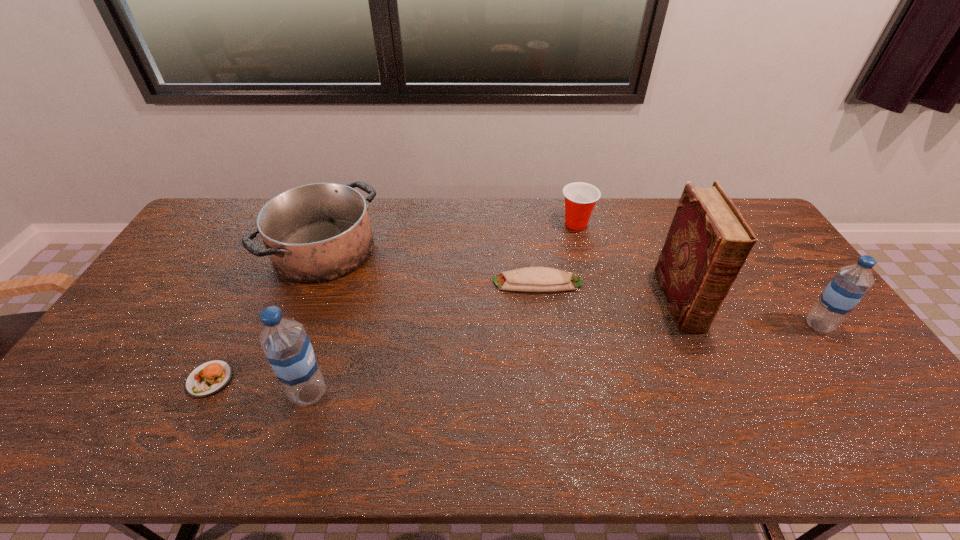
This screenshot has width=960, height=540. In order to click on the nearer water bottle in this screenshot , I will do `click(288, 348)`.

At what (x,y) coordinates should I click in order to perform the action: click on the taller water bottle. Please return your answer as a coordinate pair (x, y). This screenshot has height=540, width=960. Looking at the image, I should click on (288, 348).

Image resolution: width=960 pixels, height=540 pixels. What are the coordinates of `the right water bottle` in the screenshot? It's located at (850, 284).

You are a GUI agent. You are given a task and a screenshot of the screen. Output one action in this format:
    pyautogui.click(x=<x>, y=<y>)
    Task: Click on the shorter water bottle
    
    Given the screenshot: What is the action you would take?
    pyautogui.click(x=850, y=284)

You are a GUI agent. You are given a task and a screenshot of the screen. Output one action in this format:
    pyautogui.click(x=<x>, y=<y>)
    Task: Click on the fourth tallest object
    Image resolution: width=960 pixels, height=540 pixels.
    Given the screenshot: What is the action you would take?
    pyautogui.click(x=314, y=233)

What are the coordinates of `cup` in the screenshot? It's located at (580, 198).

Locate an element on the screen. The width and height of the screenshot is (960, 540). hardback book is located at coordinates (709, 240).

The image size is (960, 540). I want to click on burrito, so click(x=530, y=279).

Find the location of a particular element. This screenshot has width=960, height=540. patty is located at coordinates (207, 379).

Identify the location of blank space located on the label of the nearer water bottle. The width and height of the screenshot is (960, 540). (400, 393).